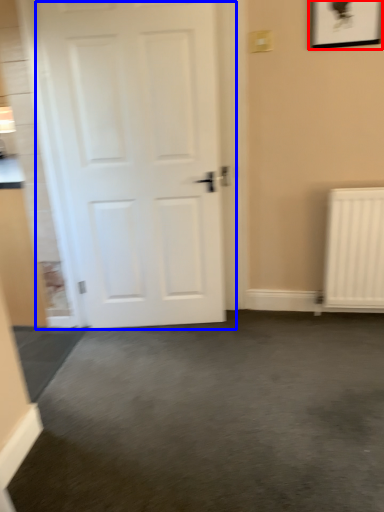
Question: Among these objects, which one is farthest to the camera, picture frame (highlighted by a red box) or door (highlighted by a blue box)?

Choices:
 (A) picture frame
 (B) door

Answer: (A)